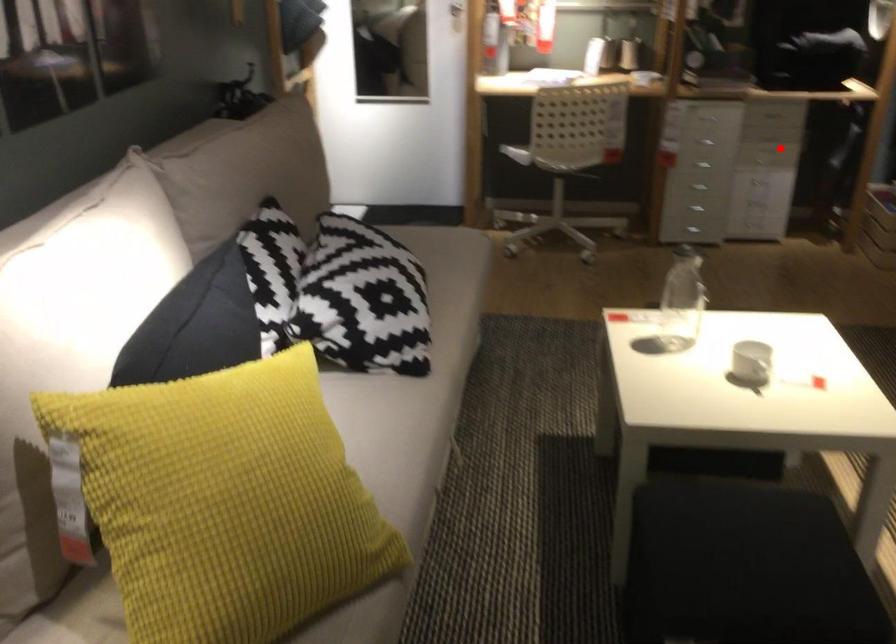
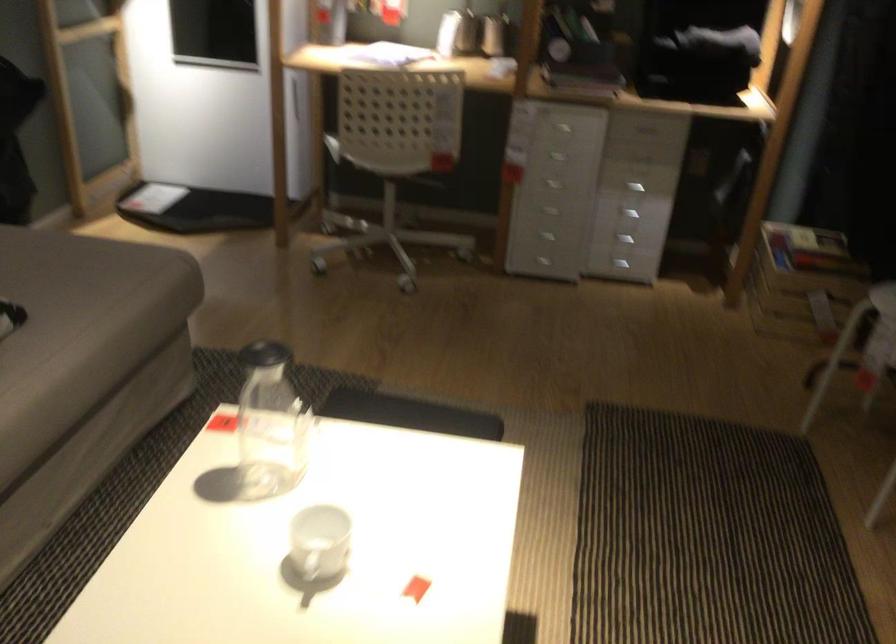
The point at the highlighted location is marked in the first image. Where is the corresponding point in the second image?

(634, 187)